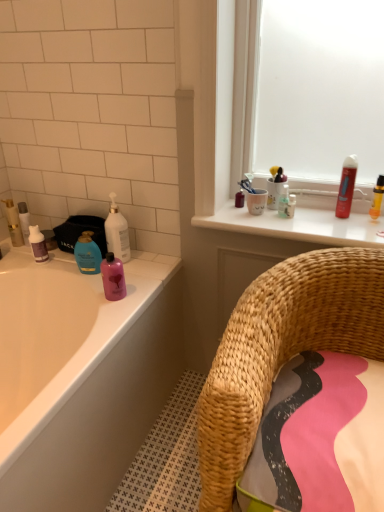
Where is `free location in front of translucent plastic toothbrush at upper center, which appears as the 4th toiletry when viewed from the left`? Image resolution: width=384 pixels, height=512 pixels. free location in front of translucent plastic toothbrush at upper center, which appears as the 4th toiletry when viewed from the left is located at coordinates (294, 225).